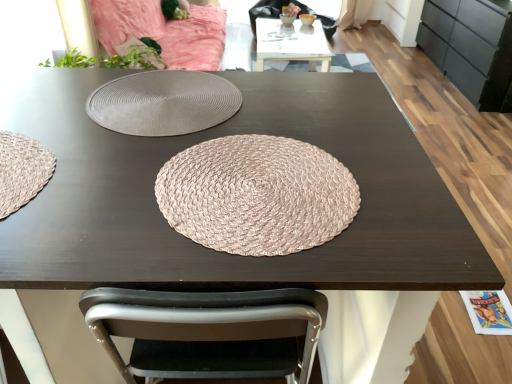
Identify the location of unoccupied space behind pink woven mat at center. Image resolution: width=512 pixels, height=384 pixels. (303, 107).